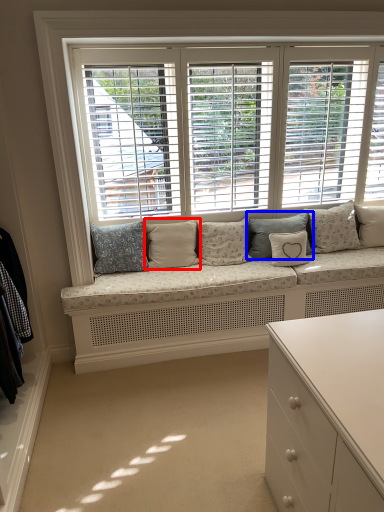
Question: Which object appears farthest to the camera in this image, pillow (highlighted by a red box) or pillow (highlighted by a blue box)?

Choices:
 (A) pillow
 (B) pillow

Answer: (B)